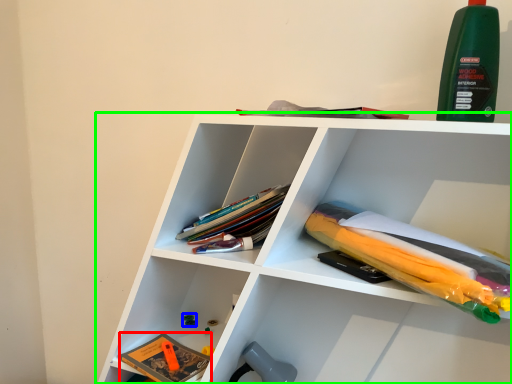
Question: Based on their relative distances, which object is farther from book (highlighted by a red box)? Choose from toy (highlighted by a blue box) and shelf (highlighted by a green box).

Choices:
 (A) toy
 (B) shelf

Answer: (B)